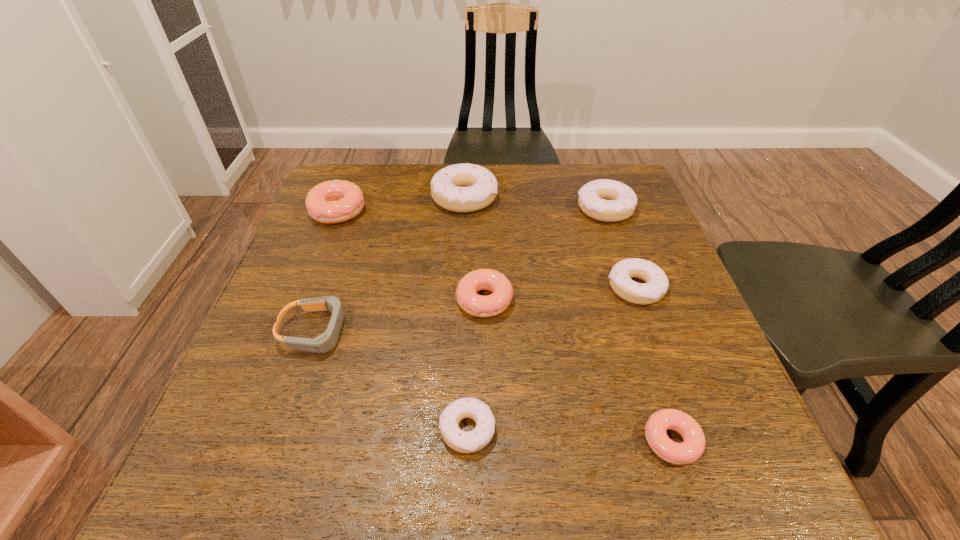
Image resolution: width=960 pixels, height=540 pixels. Find the location of `goggles located in the left edge section of the desktop`. goggles located in the left edge section of the desktop is located at coordinates (325, 342).

At what (x,y) coordinates should I click in order to perform the action: click on object that is at the far left corner. Please return your answer as a coordinate pair (x, y). The image size is (960, 540). Looking at the image, I should click on (335, 201).

Locate an element on the screen. The width and height of the screenshot is (960, 540). object located at the far right corner is located at coordinates (606, 200).

Identify the location of object located in the near right corner section of the desktop. (693, 445).

Locate an element on the screen. The height and width of the screenshot is (540, 960). vacant area at the far edge is located at coordinates (524, 175).

In the image, there is a desktop. At what (x,y) coordinates should I click in order to perform the action: click on vacant space at the left edge. Please return your answer as a coordinate pair (x, y). Image resolution: width=960 pixels, height=540 pixels. Looking at the image, I should click on (263, 337).

In order to click on vacant space at the right edge of the desktop in this screenshot , I will do `click(668, 390)`.

Locate an element on the screen. This screenshot has width=960, height=540. blank area at the far left corner is located at coordinates coord(384,168).

Find the location of a particular element. The width and height of the screenshot is (960, 540). vacant space at the near left corner of the desktop is located at coordinates (277, 448).

This screenshot has width=960, height=540. In the image, there is a desktop. In order to click on free space at the far right corner in this screenshot , I will do `click(585, 170)`.